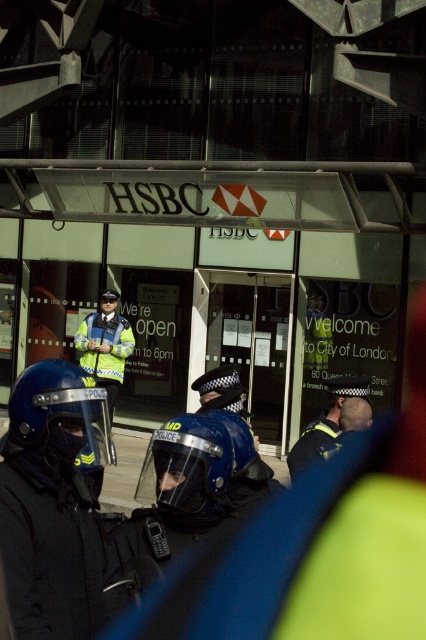
In the scene shown: You are a photographer trying to capture a clear shot of the HSBC bank entrance at night. You notice two helmets in the foreground, a matte blue helmet at center and a blue hardshell helmet at center. Which helmet would appear larger in your photo?

The matte blue helmet at center appears larger in the photo because it is bigger than the blue hardshell helmet at center.

You are a delivery person approaching the HSBC bank entrance. There are two points marked on the ground in front of you. The first point is at coordinates point (97, 412) and the second is at point (238, 422). Which point should you step on first to reach the entrance without crossing paths with the police line?

You should step on point (97, 412) first because it is in front of point (238, 422), so stepping on it first will keep you on the correct path towards the entrance without crossing the police line.

You are a delivery person trying to identify an officer who is wearing both a blue matte helmet at center and a high visibility jacket at center. Which item would be harder to see from a distance? Explain your reasoning based on the scene description.

The blue matte helmet at center would be harder to see from a distance because it is thinner than the high visibility jacket at center, making it less visible in the dim nighttime lighting.